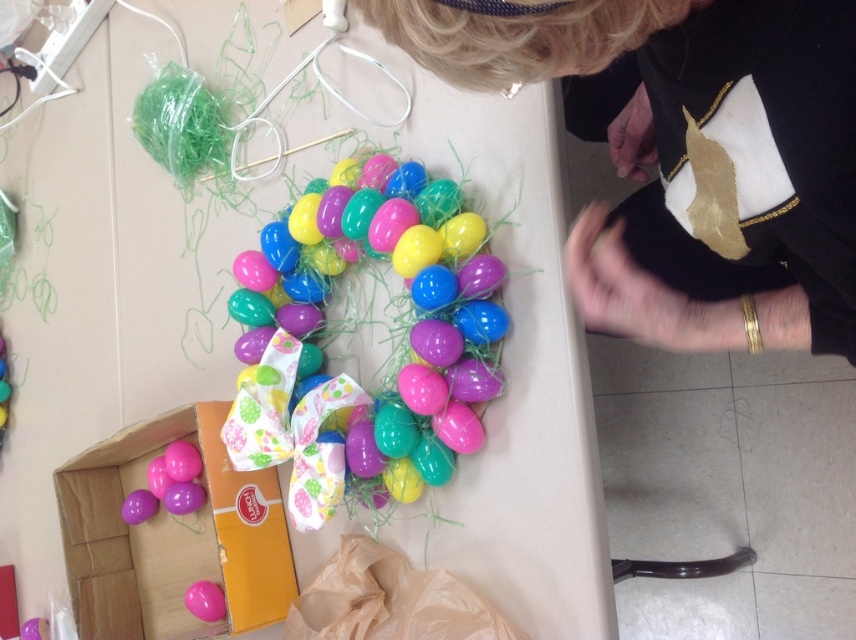
You are organizing a craft fair and need to display the matte pink eggs at lower left and the pink glossy balloon at lower left on a shelf. The shelf has a width of 6 inches. Can both items fit side by side on the shelf without overlapping?

The matte pink eggs at lower left is 6.77 inches from the pink glossy balloon at lower left, meaning the combined width of both items is 6.77 inches. Since the shelf is only 6 inches wide, they cannot fit side by side without overlapping.

You are setting up decorations for a party and notice the black fabric at upper center and the pink glossy balloon at lower left. Which object is covering the other one?

The black fabric at upper center is positioned over the pink glossy balloon at lower left, so it is covering the balloon.

You are a craft designer who needs to place two stickers on the wreath. The first sticker should be placed at point (681,106) and the second at point (214,611). Which sticker will be closer to the viewer?

The sticker placed at point (681,106) will be closer to the viewer because it is in front of point (214,611) according to the spatial arrangement.